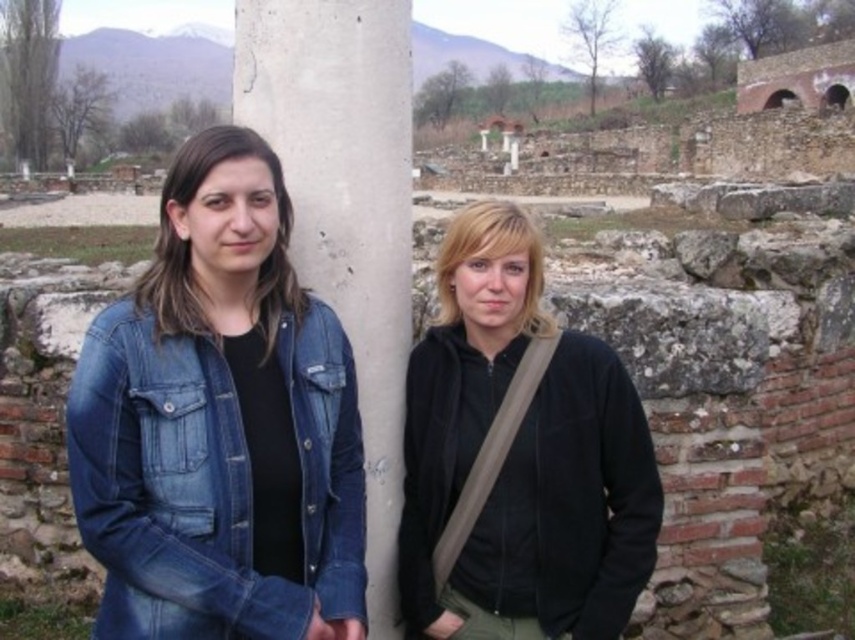
Question: Is black matte jacket at center closer to camera compared to denim jacket at left?

Choices:
 (A) yes
 (B) no

Answer: (B)

Question: Can you confirm if black matte jacket at center is positioned to the right of gray concrete pillar at center?

Choices:
 (A) yes
 (B) no

Answer: (A)

Question: Based on their relative distances, which object is farther from the gray concrete pillar at center?

Choices:
 (A) black matte jacket at center
 (B) denim jacket at left

Answer: (B)

Question: Which point appears farthest from the camera in this image?

Choices:
 (A) (386, 284)
 (B) (604, 602)
 (C) (111, 380)

Answer: (A)

Question: Which point is farther to the camera?

Choices:
 (A) denim jacket at left
 (B) black matte jacket at center
 (C) gray concrete pillar at center

Answer: (C)

Question: Does black matte jacket at center appear over denim jacket at left?

Choices:
 (A) yes
 (B) no

Answer: (A)